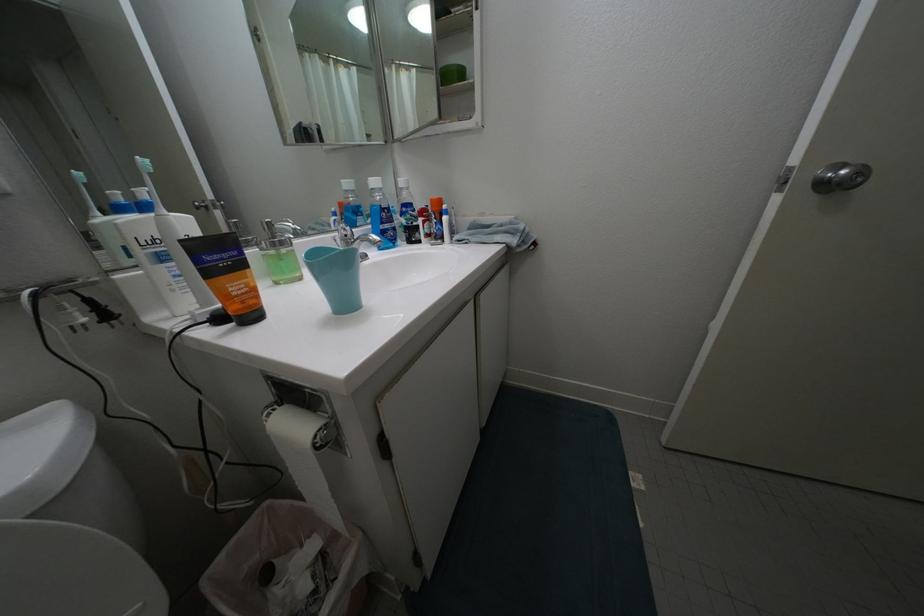
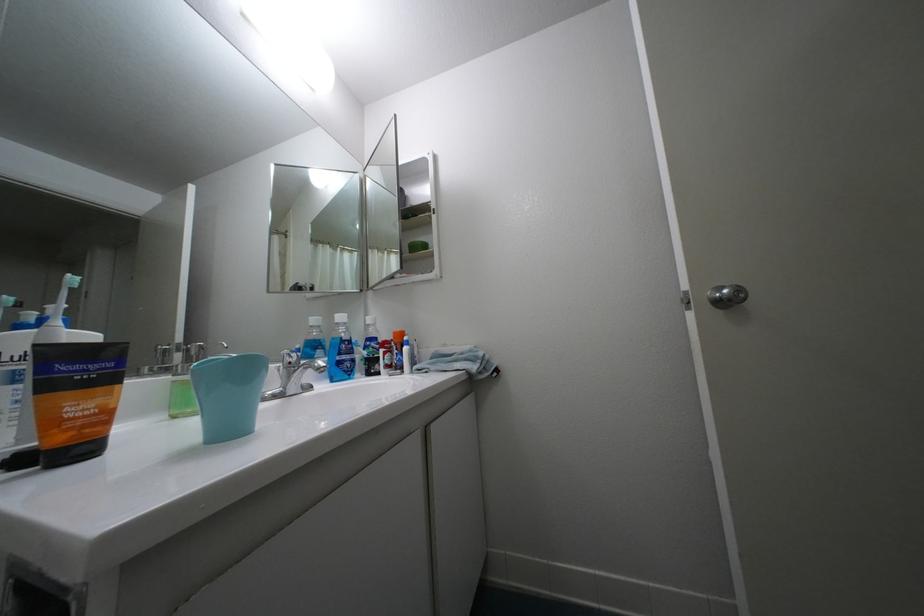
Question: Based on the continuous images, in which direction is the camera rotating? Reply with the corresponding letter.

Choices:
 (A) Left
 (B) Right
 (C) Up
 (D) Down

Answer: (C)